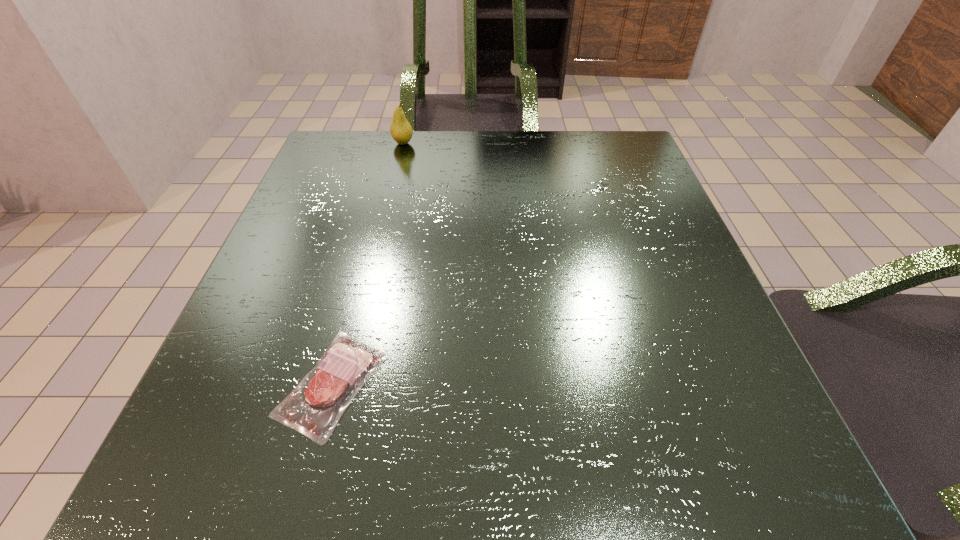
Locate an element on the screen. The height and width of the screenshot is (540, 960). free space in the image that satisfies the following two spatial constraints: 1. on the back side of the farther object; 2. on the right side of the shorter object is located at coordinates (396, 143).

In order to click on blank space that satisfies the following two spatial constraints: 1. on the back side of the nearer object; 2. on the right side of the farther object in this screenshot , I will do `click(396, 143)`.